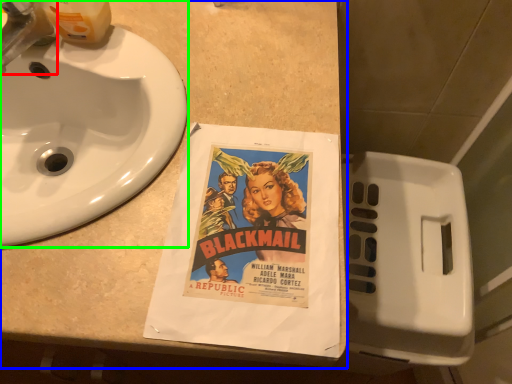
Question: Based on their relative distances, which object is farther from faucet (highlighted by a red box)? Choose from counter top (highlighted by a blue box) and sink (highlighted by a green box).

Choices:
 (A) counter top
 (B) sink

Answer: (A)